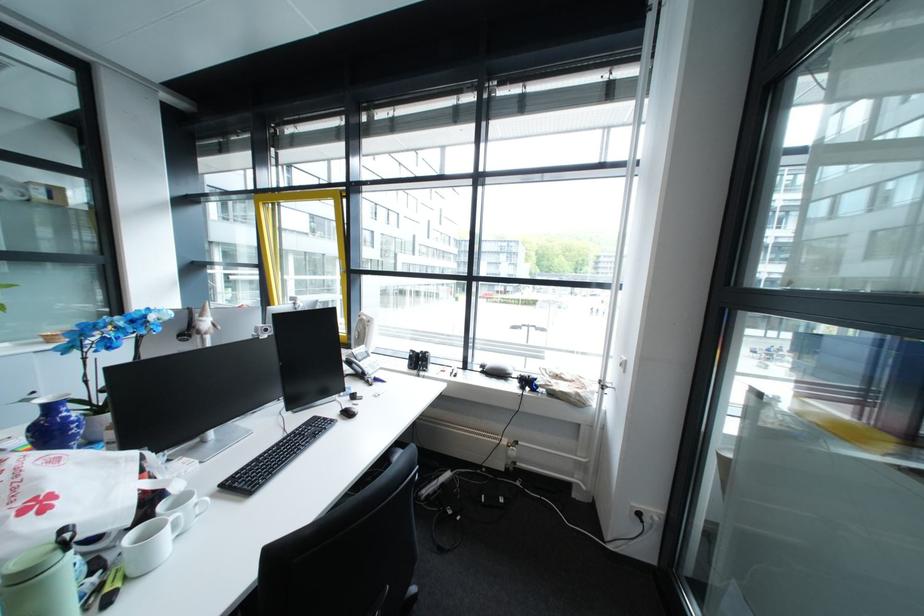
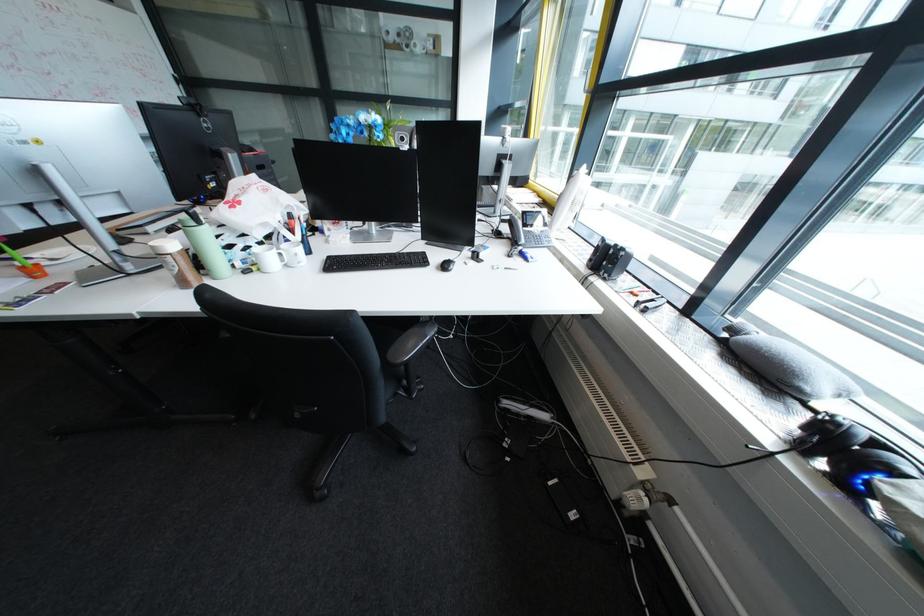
In the second image, find the point that corresponds to point (550, 379) in the first image.

(909, 474)